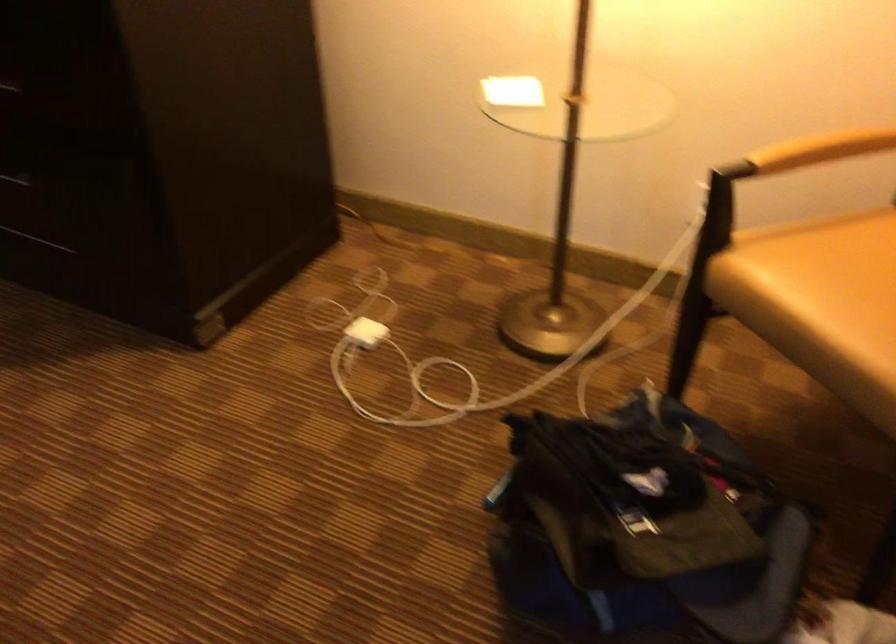
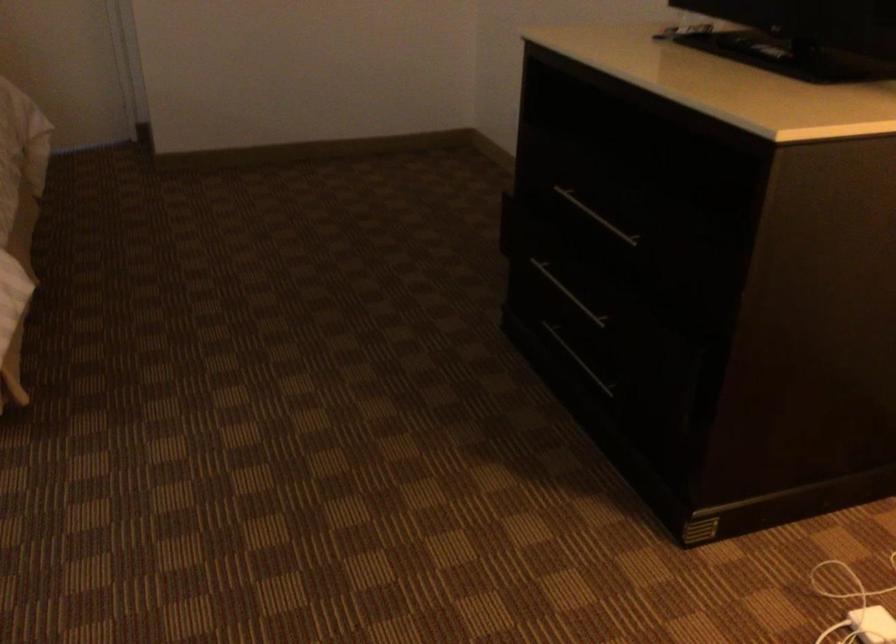
The point at (357,337) is marked in the first image. Where is the corresponding point in the second image?

(872, 625)